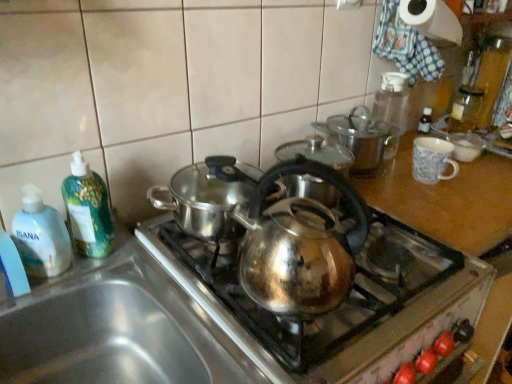
Find the location of `vacant area located to the right-hand side of green plastic bottle at left, the 3th bottle in the back-to-front sequence`. vacant area located to the right-hand side of green plastic bottle at left, the 3th bottle in the back-to-front sequence is located at coordinates (151, 273).